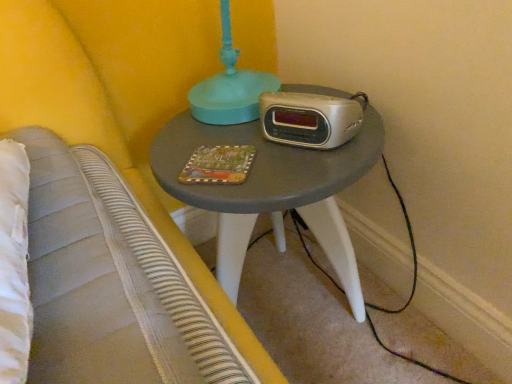
Question: From a real-world perspective, is silver metallic clock radio at center above or below matte painted wood book at center?

Choices:
 (A) below
 (B) above

Answer: (B)

Question: From the image's perspective, is silver metallic clock radio at center positioned above or below matte painted wood book at center?

Choices:
 (A) above
 (B) below

Answer: (A)

Question: Which is farther from the matte gray table at center?

Choices:
 (A) matte painted wood book at center
 (B) silver metallic clock radio at center

Answer: (A)

Question: Estimate the real-world distances between objects in this image. Which object is closer to the matte gray table at center?

Choices:
 (A) matte painted wood book at center
 (B) silver metallic clock radio at center

Answer: (B)